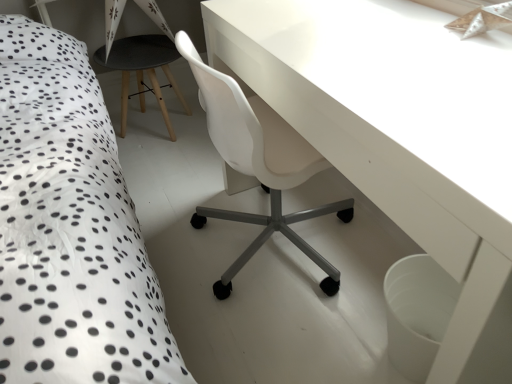
Question: Does point pos(182,102) appear closer or farther from the camera than point pos(421,183)?

Choices:
 (A) closer
 (B) farther

Answer: (B)

Question: Considering the positions of black matte stool at center and white glossy table at center in the image, is black matte stool at center taller or shorter than white glossy table at center?

Choices:
 (A) short
 (B) tall

Answer: (A)

Question: From a real-world perspective, is black matte stool at center physically located above or below white glossy table at center?

Choices:
 (A) above
 (B) below

Answer: (B)

Question: From the image's perspective, is white glossy table at center above or below black matte stool at center?

Choices:
 (A) above
 (B) below

Answer: (B)

Question: Is point (501, 274) positioned closer to the camera than point (164, 36)?

Choices:
 (A) farther
 (B) closer

Answer: (B)

Question: Do you think white glossy table at center is within black matte stool at center, or outside of it?

Choices:
 (A) outside
 (B) inside

Answer: (A)

Question: Considering the positions of white glossy table at center and black matte stool at center in the image, is white glossy table at center wider or thinner than black matte stool at center?

Choices:
 (A) wide
 (B) thin

Answer: (B)